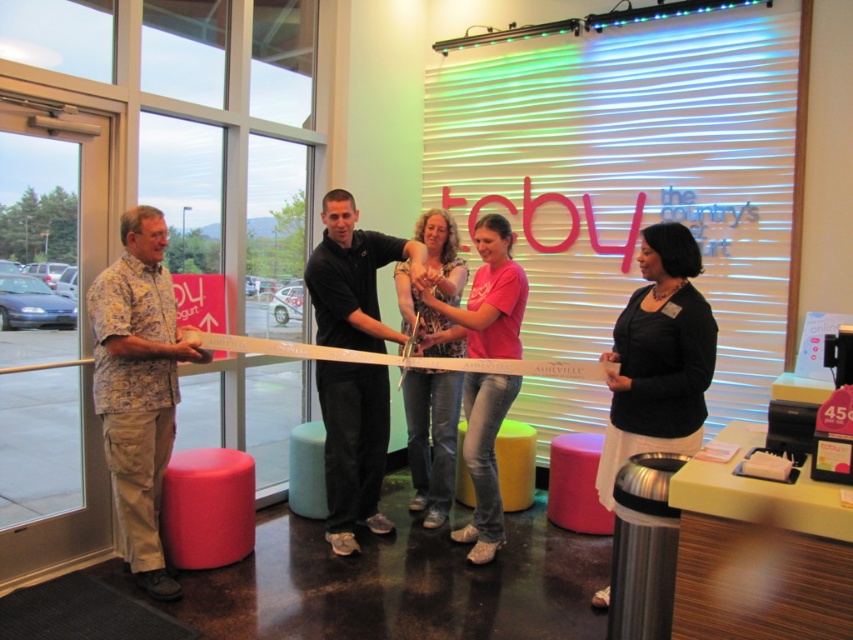
You are attending the ribbon cutting ceremony and notice the hawaiian print shirt at left and the matte pink stool at center. Which object is positioned higher in the image?

The hawaiian print shirt at left is above the matte pink stool at center, so it is positioned higher in the image.